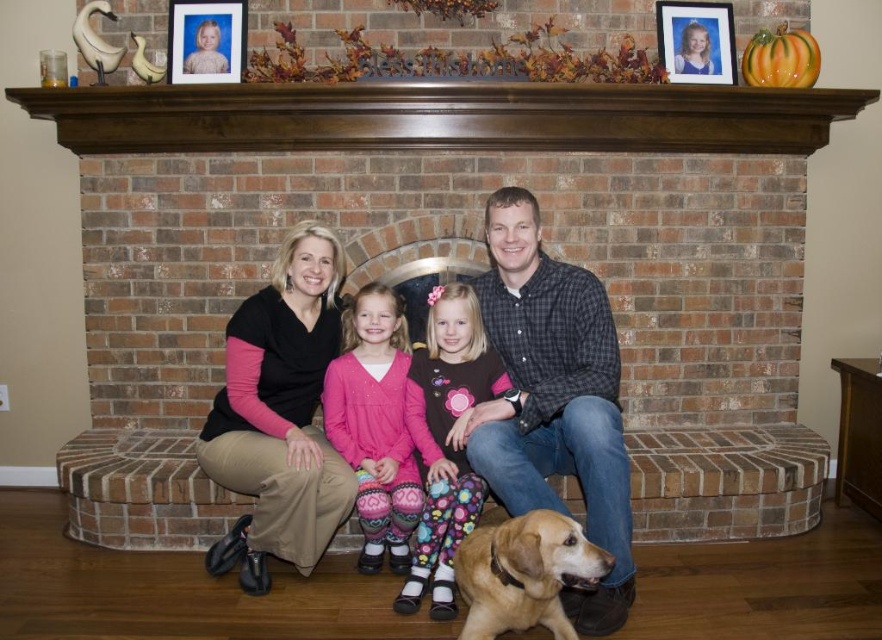
Between checkered shirt at center and floral leggings at center, which one appears on the left side from the viewer's perspective?

floral leggings at center is more to the left.

Which of these two, checkered shirt at center or floral leggings at center, stands taller?

checkered shirt at center is taller.

Between point (529, 381) and point (428, 348), which one is positioned behind?

Point (428, 348)

Where is `checkered shirt at center`? checkered shirt at center is located at coordinates (552, 397).

How distant is brick fireplace at center from brown wood mantle at upper center?

brick fireplace at center and brown wood mantle at upper center are 14.94 inches apart from each other.

Looking at this image, which is above, brick fireplace at center or brown wood mantle at upper center?

brown wood mantle at upper center is above.

Does point (356, 113) come behind point (363, 136)?

No, (356, 113) is closer to viewer.

At what (x,y) coordinates should I click in order to perform the action: click on brick fireplace at center. Please return your answer as a coordinate pair (x, y). The height and width of the screenshot is (640, 882). Looking at the image, I should click on (473, 243).

Is floral leggings at center wider than matte plastic picture frame at upper right?

Yes.

Between point (417, 403) and point (716, 72), which one is positioned behind?

The point (716, 72) is behind.

Does point (442, 579) lie behind point (730, 81)?

No, it is in front of (730, 81).

Locate an element on the screen. floral leggings at center is located at coordinates (446, 440).